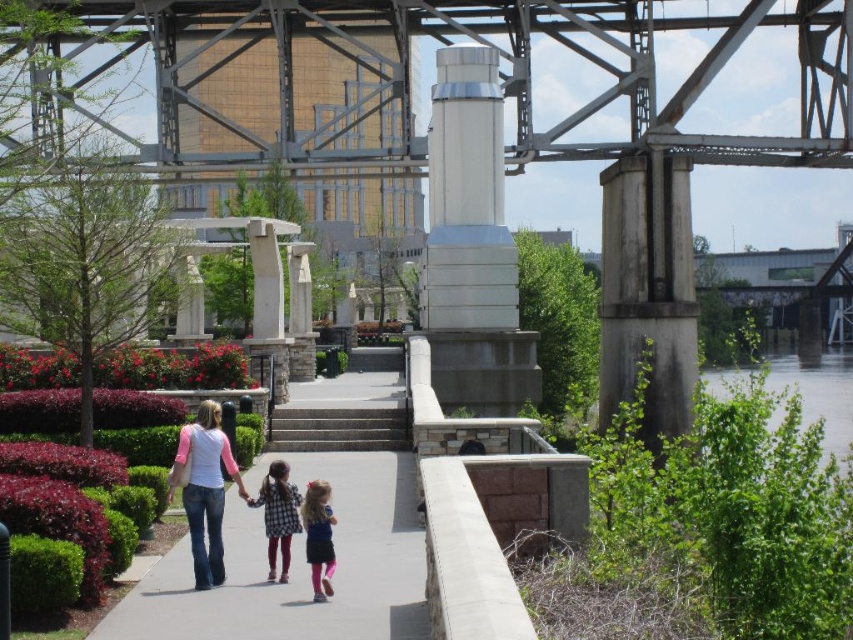
Question: Among these points, which one is nearest to the camera?

Choices:
 (A) (230, 493)
 (B) (216, 403)

Answer: (B)

Question: Which point appears farthest from the camera in this image?

Choices:
 (A) (525, 147)
 (B) (310, 564)
 (C) (285, 467)
 (D) (213, 404)

Answer: (A)

Question: Can you confirm if metallic gray bridge at center is positioned to the right of pink jersey at left?

Choices:
 (A) no
 (B) yes

Answer: (B)

Question: Does metallic gray bridge at center have a smaller size compared to gray concrete pavement at center?

Choices:
 (A) yes
 (B) no

Answer: (B)

Question: Which of the following is the farthest from the observer?

Choices:
 (A) (198, 566)
 (B) (61, 1)
 (C) (337, 458)

Answer: (B)

Question: Can you confirm if gray concrete stairs at center is smaller than plaid fabric shirt at center?

Choices:
 (A) no
 (B) yes

Answer: (A)